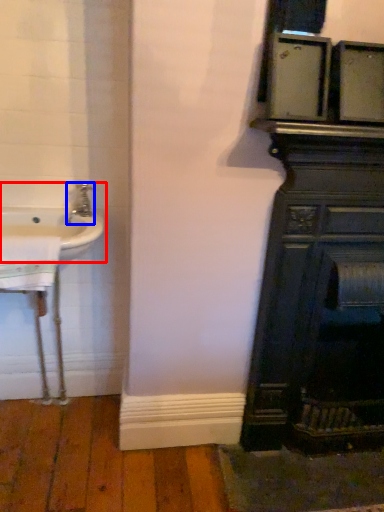
Question: Which object is further to the camera taking this photo, sink (highlighted by a red box) or tap (highlighted by a blue box)?

Choices:
 (A) sink
 (B) tap

Answer: (B)